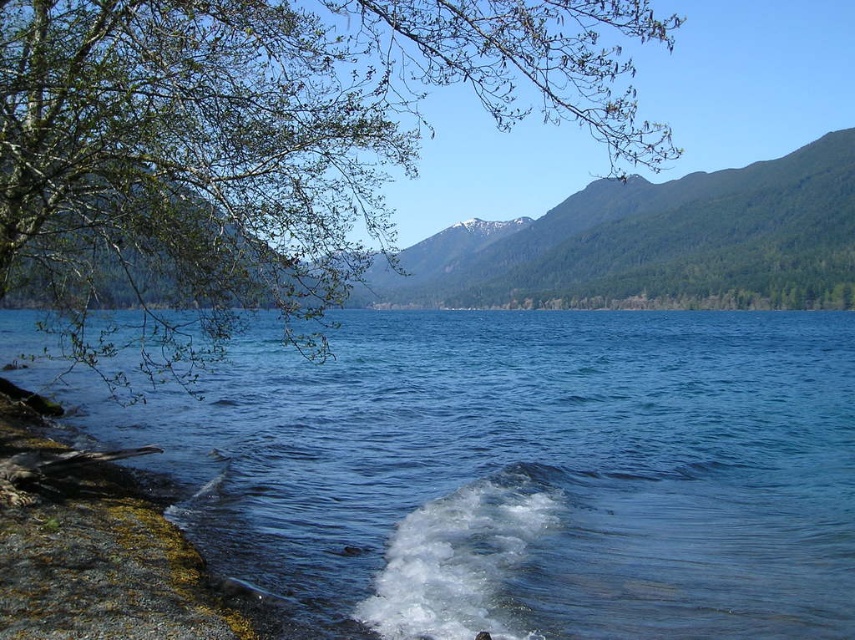
You are standing at the lakeside and see two points marked on the image. The first point is at coordinates point (749, 200) and the second is at point (105, 529). Which point is closer to you?

Point (749, 200) is closer to you because it is further to the viewer than point (105, 529).

You are standing at the lakeside and want to take a photo of the green leafy tree at upper left. If your camera has a maximum zoom range of 10 meters, will you be able to capture the tree clearly without moving closer?

The green leafy tree at upper left is 10.99 meters from the viewer. Since the camera can only zoom up to 10 meters, you won not be able to capture the tree clearly without moving closer.

You are an artist planning to paint this lakeside scene. You want to ensure that the green leafy tree at upper left and the green forested mountain at upper center are proportionally accurate. Which object should you paint smaller to maintain the scene as shown?

The green leafy tree at upper left should be painted smaller than the green forested mountain at upper center to maintain the scene as shown.